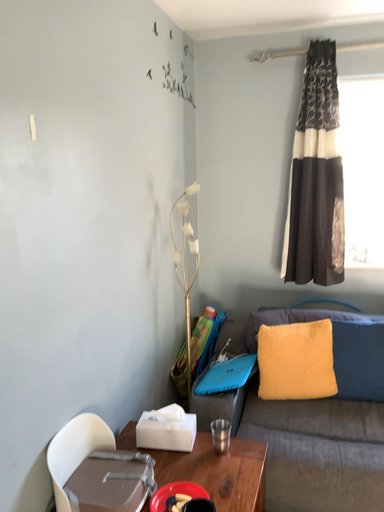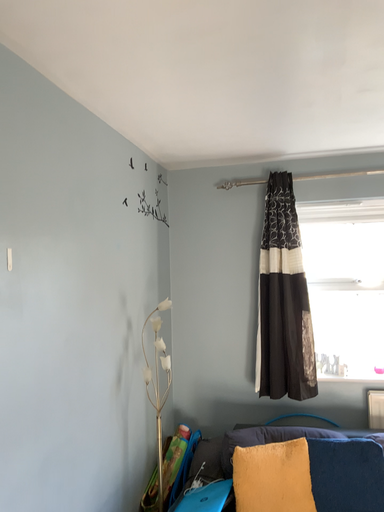
Question: How did the camera likely rotate when shooting the video?

Choices:
 (A) rotated downward
 (B) rotated upward

Answer: (B)